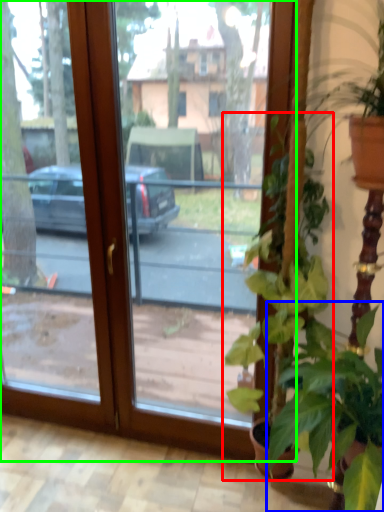
Question: Considering the real-world distances, which object is closest to houseplant (highlighted by a red box)? houseplant (highlighted by a blue box) or window (highlighted by a green box).

Choices:
 (A) houseplant
 (B) window

Answer: (A)